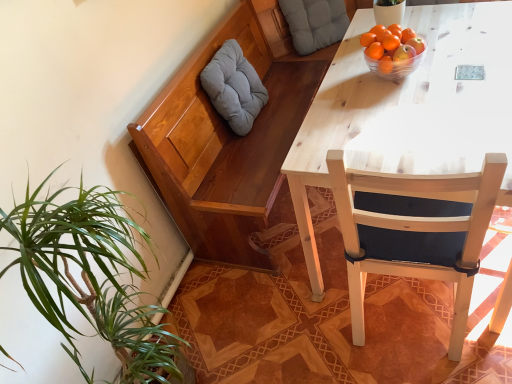
Question: From the image's perspective, is orange matte at upper right located above or below transparent glass bowl at upper right?

Choices:
 (A) above
 (B) below

Answer: (A)

Question: Which is correct: orange matte at upper right is inside transparent glass bowl at upper right, or outside of it?

Choices:
 (A) outside
 (B) inside

Answer: (A)

Question: Considering the real-world distances, which object is farthest from the wooden chair at right?

Choices:
 (A) orange matte at upper right
 (B) orange matte tangerine at upper right
 (C) gray fabric pillow at upper left, positioned as the 2th pillow in top-to-bottom order
 (D) transparent glass bowl at upper right
 (E) gray fabric pillow at upper center, the first pillow from the right

Answer: (E)

Question: Estimate the real-world distances between objects in this image. Which object is farther from the gray fabric pillow at upper center, the first pillow from the right?

Choices:
 (A) transparent glass bowl at upper right
 (B) orange matte at upper right
 (C) gray fabric pillow at upper left, arranged as the 1th pillow when ordered from the bottom
 (D) wooden chair at right
 (E) orange matte tangerine at upper right

Answer: (D)